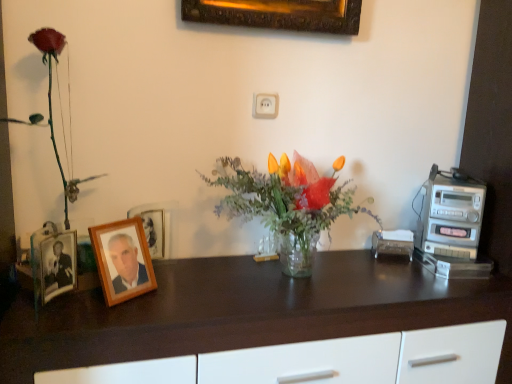
Question: Could wooden picture frame at left, acting as the second picture frame starting from the front, be considered to be inside dark wood desk at center?

Choices:
 (A) yes
 (B) no

Answer: (B)

Question: Are dark wood desk at center and wooden picture frame at left, acting as the second picture frame starting from the front, making contact?

Choices:
 (A) no
 (B) yes

Answer: (A)

Question: Considering the relative sizes of dark wood desk at center and wooden picture frame at left, arranged as the first picture frame when viewed from the back, in the image provided, is dark wood desk at center wider than wooden picture frame at left, arranged as the first picture frame when viewed from the back,?

Choices:
 (A) no
 (B) yes

Answer: (B)

Question: Is dark wood desk at center behind wooden picture frame at left, acting as the second picture frame starting from the front?

Choices:
 (A) no
 (B) yes

Answer: (A)

Question: Is dark wood desk at center closer to camera compared to wooden picture frame at left, arranged as the first picture frame when viewed from the back?

Choices:
 (A) yes
 (B) no

Answer: (A)

Question: From the image's perspective, is wooden picture frame at left, arranged as the first picture frame when viewed from the back, positioned above or below matte plastic rose at left?

Choices:
 (A) above
 (B) below

Answer: (B)

Question: In terms of height, does wooden picture frame at left, arranged as the first picture frame when viewed from the back, look taller or shorter compared to matte plastic rose at left?

Choices:
 (A) short
 (B) tall

Answer: (A)

Question: Is wooden picture frame at left, arranged as the first picture frame when viewed from the back, in front of or behind matte plastic rose at left in the image?

Choices:
 (A) front
 (B) behind

Answer: (B)

Question: Is point (165, 213) closer or farther from the camera than point (57, 52)?

Choices:
 (A) closer
 (B) farther

Answer: (B)

Question: Looking at their shapes, would you say silver metallic stereo at right is wider or thinner than matte plastic rose at left?

Choices:
 (A) thin
 (B) wide

Answer: (B)

Question: From a real-world perspective, relative to matte plastic rose at left, is silver metallic stereo at right vertically above or below?

Choices:
 (A) below
 (B) above

Answer: (A)

Question: Relative to matte plastic rose at left, is silver metallic stereo at right in front or behind?

Choices:
 (A) front
 (B) behind

Answer: (B)

Question: Based on their sizes in the image, would you say silver metallic stereo at right is bigger or smaller than matte plastic rose at left?

Choices:
 (A) big
 (B) small

Answer: (B)

Question: Would you say wooden photo frame at left, the first picture frame when ordered from front to back, is inside or outside wooden picture frame at left, arranged as the first picture frame when viewed from the back?

Choices:
 (A) inside
 (B) outside

Answer: (B)

Question: Is wooden photo frame at left, the first picture frame when ordered from front to back, to the left or to the right of wooden picture frame at left, acting as the second picture frame starting from the front, in the image?

Choices:
 (A) left
 (B) right

Answer: (A)